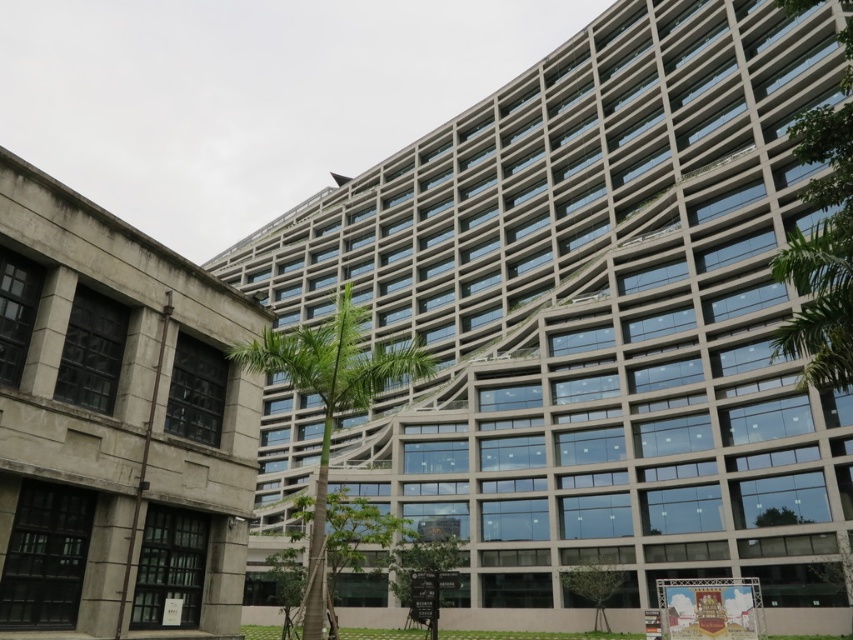
You are standing in front of the modern building and notice two trees. Which tree, the green leafy tree at right or the green leafy palm tree at center, is closer to you?

The green leafy tree at right is closer to you because it is in front of the green leafy palm tree at center.